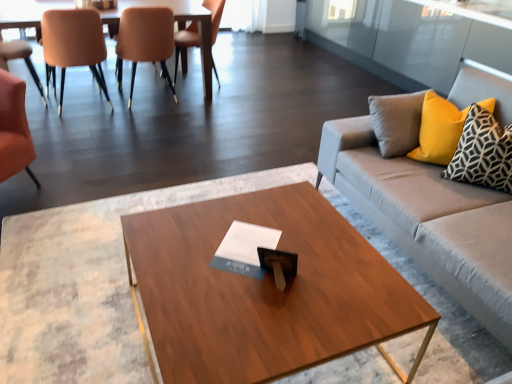
Question: Is wooden coffee table at center aimed at orange leather chair at left, the fourth chair viewed from the right?

Choices:
 (A) yes
 (B) no

Answer: (B)

Question: From the image's perspective, is wooden coffee table at center beneath orange leather chair at left, the fourth chair viewed from the right?

Choices:
 (A) no
 (B) yes

Answer: (B)

Question: Is wooden coffee table at center touching orange leather chair at left, placed as the second chair when sorted from left to right?

Choices:
 (A) yes
 (B) no

Answer: (B)

Question: From a real-world perspective, is wooden coffee table at center located beneath orange leather chair at left, placed as the second chair when sorted from left to right?

Choices:
 (A) no
 (B) yes

Answer: (B)

Question: From the image's perspective, is wooden coffee table at center located above orange leather chair at left, placed as the second chair when sorted from left to right?

Choices:
 (A) no
 (B) yes

Answer: (A)

Question: Is orange leather chair at left, placed as the second chair when sorted from left to right, in front of or behind wooden table at upper left in the image?

Choices:
 (A) behind
 (B) front

Answer: (B)

Question: In the image, is orange leather chair at left, the fourth chair viewed from the right, on the left side or the right side of wooden table at upper left?

Choices:
 (A) right
 (B) left

Answer: (B)

Question: From their relative heights in the image, would you say orange leather chair at left, the fourth chair viewed from the right, is taller or shorter than wooden table at upper left?

Choices:
 (A) tall
 (B) short

Answer: (A)

Question: Does point (0, 125) appear closer or farther from the camera than point (174, 6)?

Choices:
 (A) farther
 (B) closer

Answer: (B)

Question: From the image's perspective, is orange leather chair at left, placed as the second chair when sorted from left to right, positioned above or below yellow fabric pillow at right, which is the second pillow in back-to-front order?

Choices:
 (A) above
 (B) below

Answer: (A)

Question: In terms of size, does orange leather chair at left, the fourth chair viewed from the right, appear bigger or smaller than yellow fabric pillow at right, which is the second pillow in back-to-front order?

Choices:
 (A) big
 (B) small

Answer: (A)

Question: Looking at their shapes, would you say orange leather chair at left, placed as the second chair when sorted from left to right, is wider or thinner than yellow fabric pillow at right, which is the second pillow in back-to-front order?

Choices:
 (A) thin
 (B) wide

Answer: (B)

Question: Considering their positions, is orange leather chair at left, placed as the second chair when sorted from left to right, located in front of or behind yellow fabric pillow at right, arranged as the first pillow when viewed from the front?

Choices:
 (A) front
 (B) behind

Answer: (B)

Question: In terms of size, does gray fabric couch at right appear bigger or smaller than matte orange chair at left, which is the third chair from right to left?

Choices:
 (A) big
 (B) small

Answer: (A)

Question: Considering the positions of gray fabric couch at right and matte orange chair at left, arranged as the 3th chair when viewed from the left, in the image, is gray fabric couch at right wider or thinner than matte orange chair at left, arranged as the 3th chair when viewed from the left,?

Choices:
 (A) thin
 (B) wide

Answer: (B)